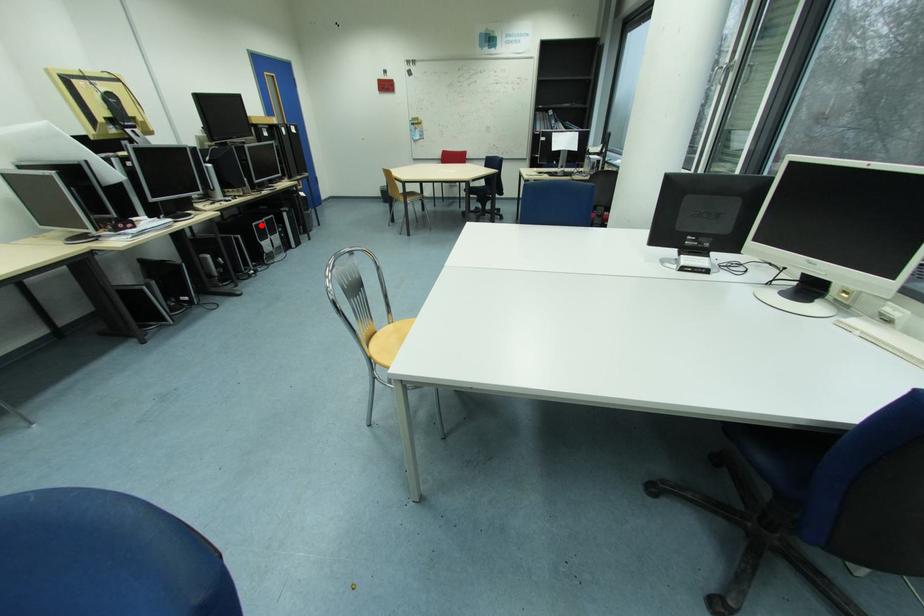
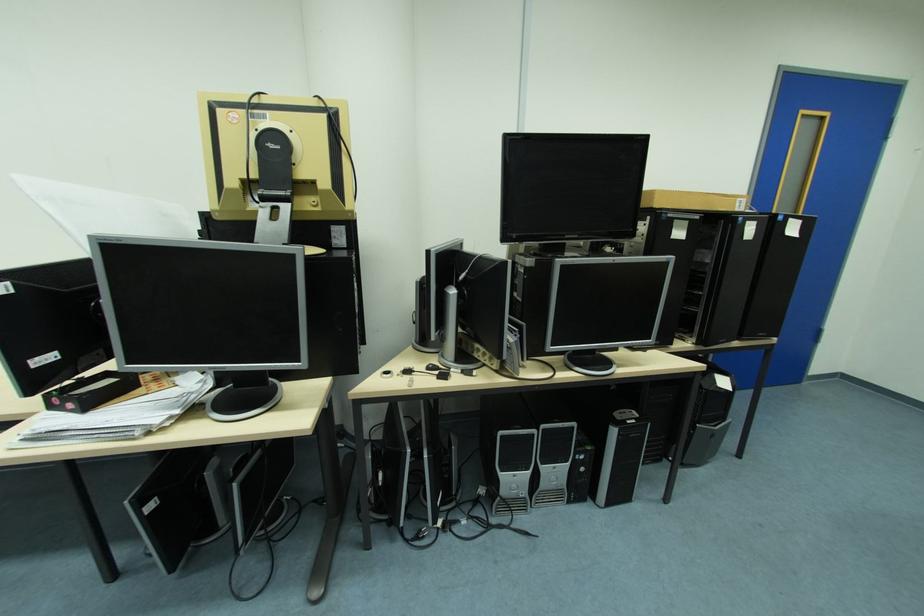
In the second image, find the point that corresponds to the highlighted location in the first image.

(507, 434)